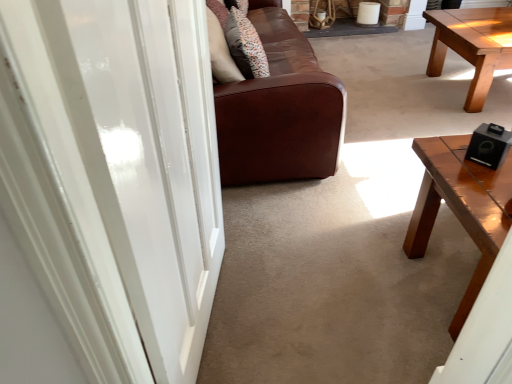
Image resolution: width=512 pixels, height=384 pixels. In order to click on vacant space underneath white glossy door at center (from a real-world perspective) in this screenshot , I will do `click(224, 318)`.